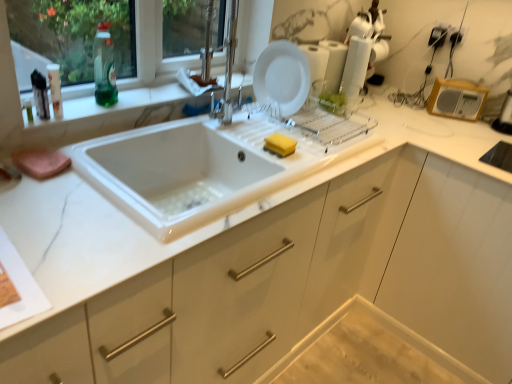
Locate an element on the screen. The image size is (512, 384). vacant space to the right of white matte plate at upper center is located at coordinates (321, 119).